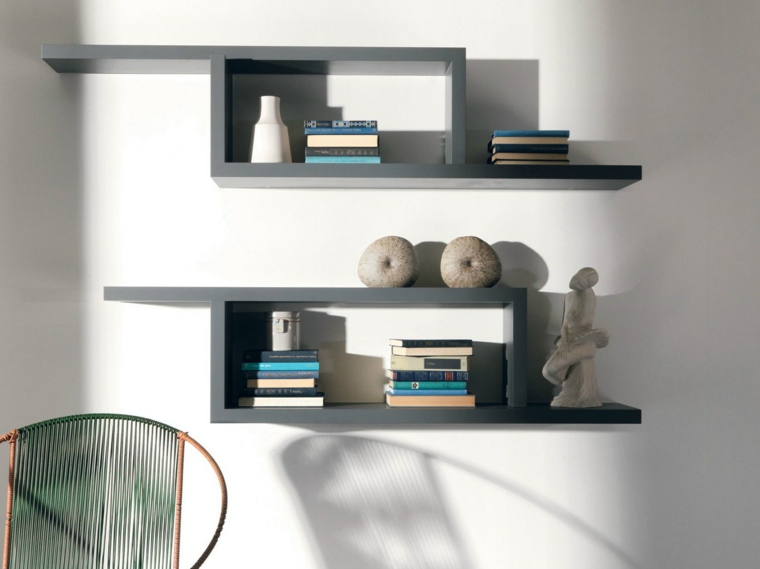
This screenshot has height=569, width=760. Identify the location of book in right stack on bottom shelf. (432, 342), (448, 351), (448, 362), (451, 377), (442, 385), (420, 393), (431, 398).